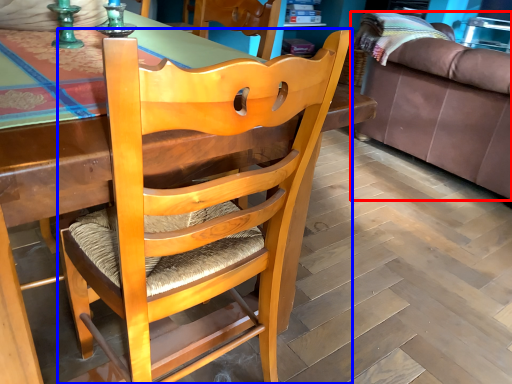
Question: Which object is further to the camera taking this photo, studio couch (highlighted by a red box) or chair (highlighted by a blue box)?

Choices:
 (A) studio couch
 (B) chair

Answer: (A)